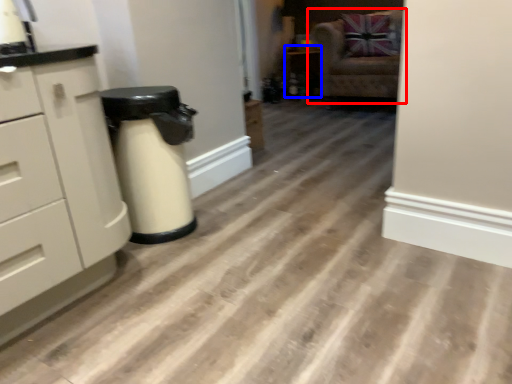
Question: Which object appears farthest to the camera in this image, chair (highlighted by a red box) or cabinetry (highlighted by a blue box)?

Choices:
 (A) chair
 (B) cabinetry

Answer: (B)